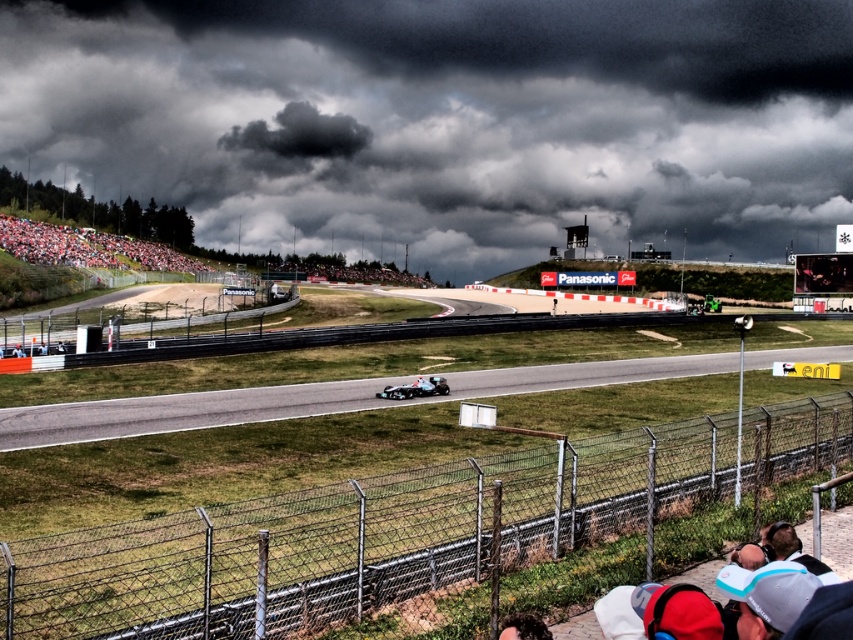
You are a drone operator at the motorsport event. Your task is to fly a drone from the grandstand fence to the Formula One race car on the track. The drone must stay above the smooth asphalt track at center to avoid interfering with the race. Given the track is at point 0.625, 0.373, what coordinates should the drone navigate to reach the car?

The drone should navigate to the coordinates (x=317, y=400) to reach the Formula One race car on the smooth asphalt track at center.

You are a photographer at the motorsport event. You want to capture a photo of the silver metallic race car at center without any obstructions. However, there is a white plastic cap at lower right in the frame. Based on their heights, can the cap block the view of the race car?

The white plastic cap at lower right has a lesser height compared to the silver metallic race car at center, so it is unlikely to block the view of the race car since it is shorter.

You are a drone operator at the motorsport event. You need to fly your drone from the grandstand fence to the Formula One race car. The grandstand fence is near point A at point (796, 548) and the race car is near point B at point (418, 387). According to the spatial relationship between these two points, which direction should you fly the drone to reach the race car?

Point (796, 548) is in front of point (418, 387), so you should fly the drone backward from point 0.858, (796, 548) towards point (418, 387) to reach the race car.